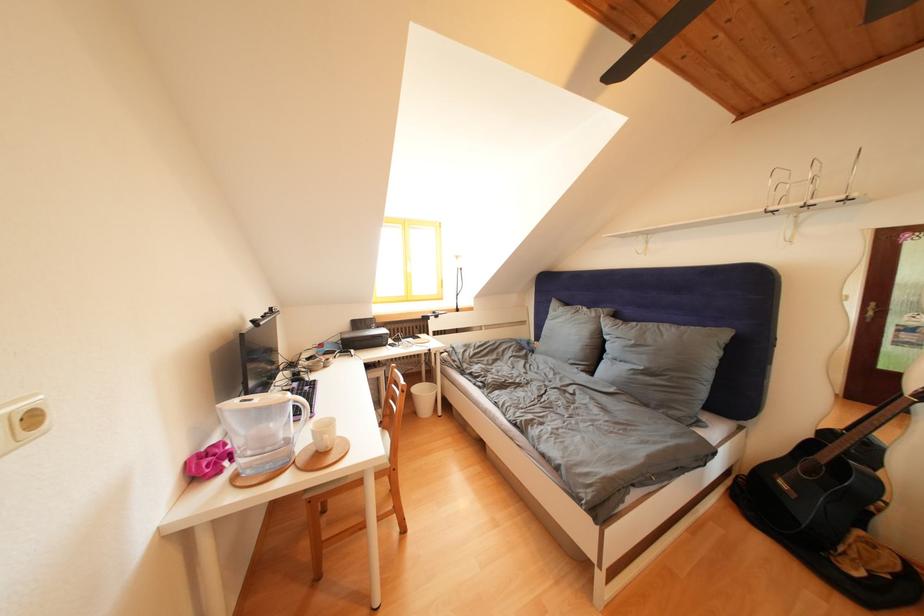
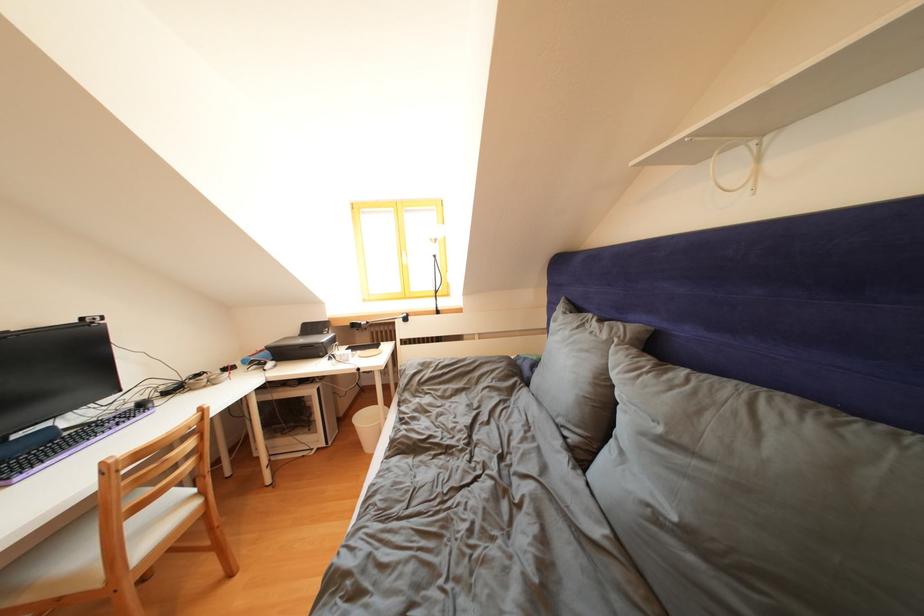
Where in the second image is the point corresponding to [367,330] from the first image?

(319, 333)